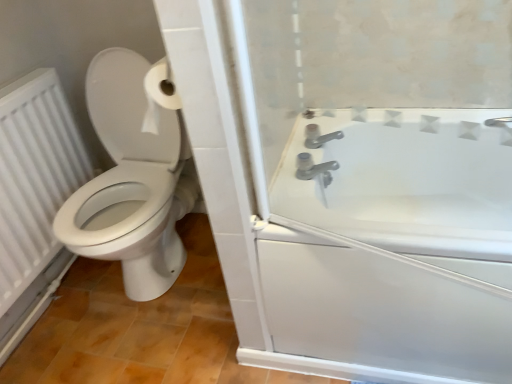
You are a GUI agent. You are given a task and a screenshot of the screen. Output one action in this format:
    pyautogui.click(x=<x>, y=<y>)
    Task: Click on the blank space to the left of satin nickel faucet at upper right
    The image size is (512, 384).
    Given the screenshot: What is the action you would take?
    pyautogui.click(x=283, y=185)